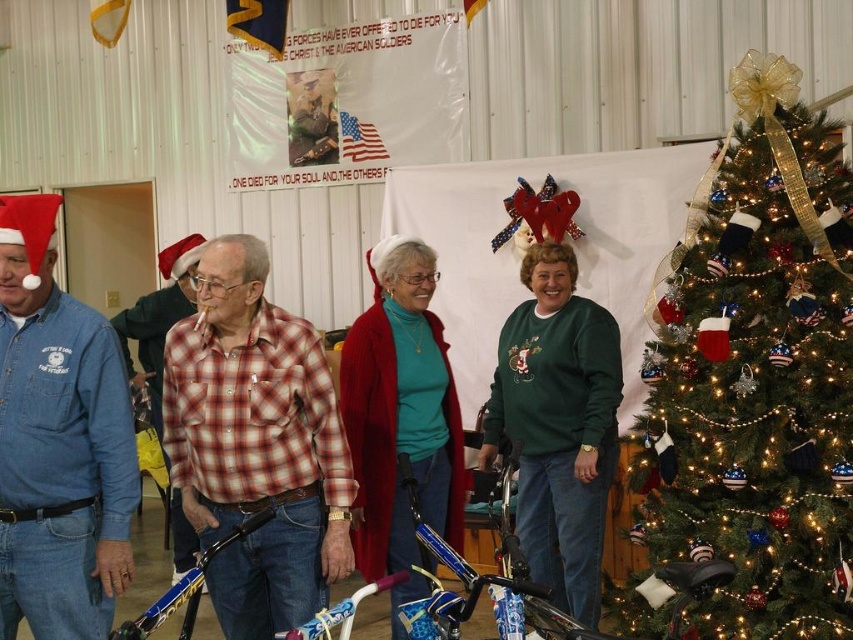
You are a photographer at the event and want to capture a closeup of the plaid shirt at center and the knitted red sweater at center. Do you think you can fit both into the camera frame without moving the camera? The camera has a 20 inch field of view.

The plaid shirt at center is 23.12 inches away from the knitted red sweater at center, which is wider than the camera frame of 20 inches. Therefore, you cannot fit both into the camera frame without moving the camera.

You are a photographer at the event and want to capture a photo that includes both the green textured christmas tree at right and the knitted red sweater at center. Which object should be placed in the background to ensure both are in focus?

The green textured christmas tree at right should be placed in the background because it is positioned over the knitted red sweater at center, meaning it is farther away. This way, both objects will be in focus when the photographer focuses on the background.

You are a photographer at the holiday gathering and want to take a photo that includes both the green textured christmas tree at right and the knitted red sweater at center. To ensure both are in the frame, should you adjust your camera angle to the left or to the right?

The green textured christmas tree at right is positioned on the right side of knitted red sweater at center. To include both in the frame, you should adjust your camera angle to the left so that the tree remains visible on the right while keeping the sweater at center in view.